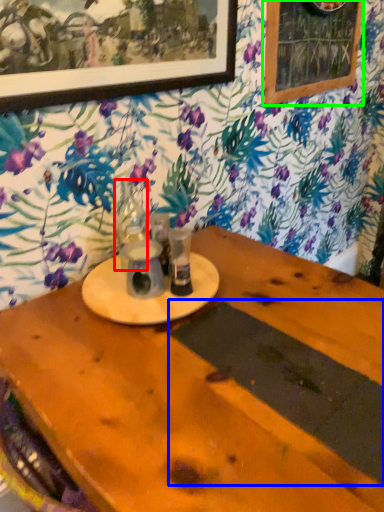
Question: Which is farther away from tableware (highlighted by a red box)? plank (highlighted by a blue box) or bulletin board (highlighted by a green box)?

Choices:
 (A) plank
 (B) bulletin board

Answer: (B)